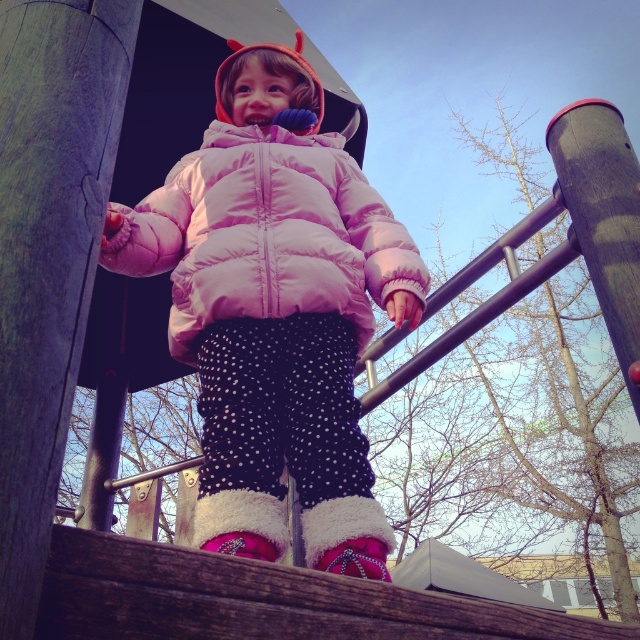
You are a photographer trying to capture a closeup shot of the pink quilted jacket at center and the smooth gray pole at upper right. Since the camera can only focus on one object at a time, which object should you focus on first to ensure it appears larger in the photo?

You should focus on the pink quilted jacket at center first because it is bigger than the smooth gray pole at upper right, so it will appear larger in the photo.

You are a parent at the park and want to ensure your child is safe. The child is wearing a pink quilted jacket at center and is near a smooth gray pole at upper right. Based on their positions, which object is closer to you as you look at the scene?

The pink quilted jacket at center is closer to you because the smooth gray pole at upper right is behind it.

The child is wearing a pink puffy jacket at center. Where exactly is the pink puffy jacket located in the image?

The pink puffy jacket at center is located at point (275, 310).